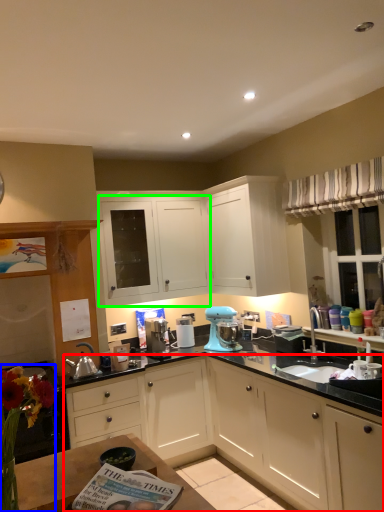
Question: Which object is positioned closest to cabinetry (highlighted by a red box)? Select from floral arrangement (highlighted by a blue box) and cabinetry (highlighted by a green box).

Choices:
 (A) floral arrangement
 (B) cabinetry

Answer: (B)